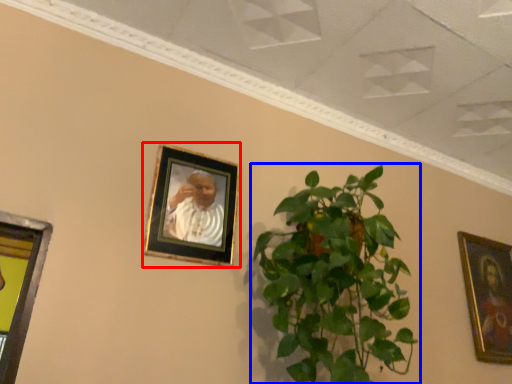
Question: Which object is further to the camera taking this photo, picture frame (highlighted by a red box) or houseplant (highlighted by a blue box)?

Choices:
 (A) picture frame
 (B) houseplant

Answer: (A)